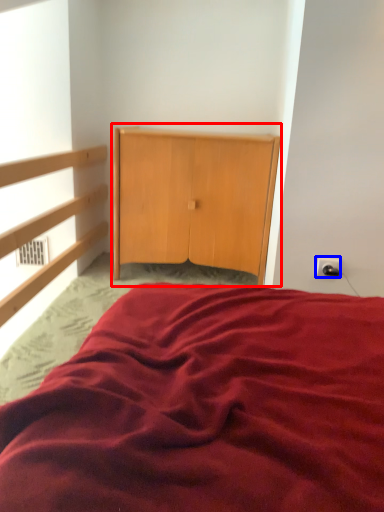
Question: Which object is closer to the camera taking this photo, dresser (highlighted by a red box) or electric outlet (highlighted by a blue box)?

Choices:
 (A) dresser
 (B) electric outlet

Answer: (B)